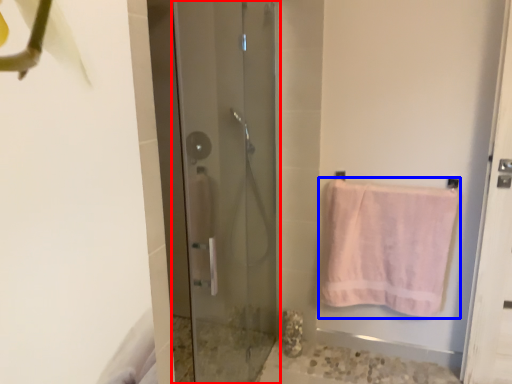
Question: Which of the following is the closest to the observer, door (highlighted by a red box) or towel (highlighted by a blue box)?

Choices:
 (A) door
 (B) towel

Answer: (A)